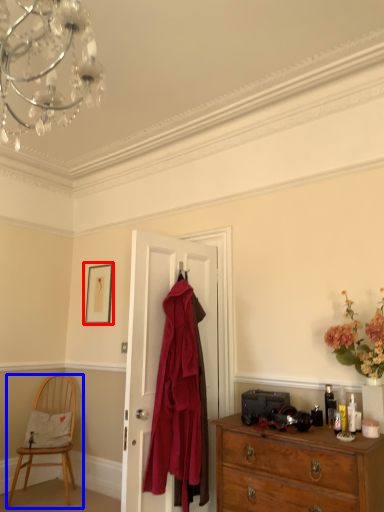
Question: Which point is further to the camera, picture frame (highlighted by a red box) or chair (highlighted by a blue box)?

Choices:
 (A) picture frame
 (B) chair

Answer: (A)